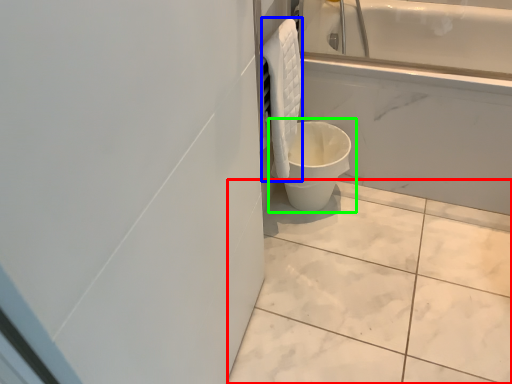
Question: Estimate the real-world distances between objects in this image. Which object is farther from ceramic tile (highlighted by a red box), material (highlighted by a blue box) or toilet (highlighted by a green box)?

Choices:
 (A) material
 (B) toilet

Answer: (A)